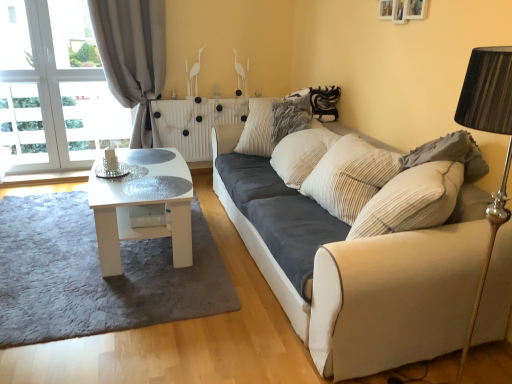
Identify the location of free space above white glossy coffee table at center (from a real-world perspective). Image resolution: width=512 pixels, height=384 pixels. (139, 177).